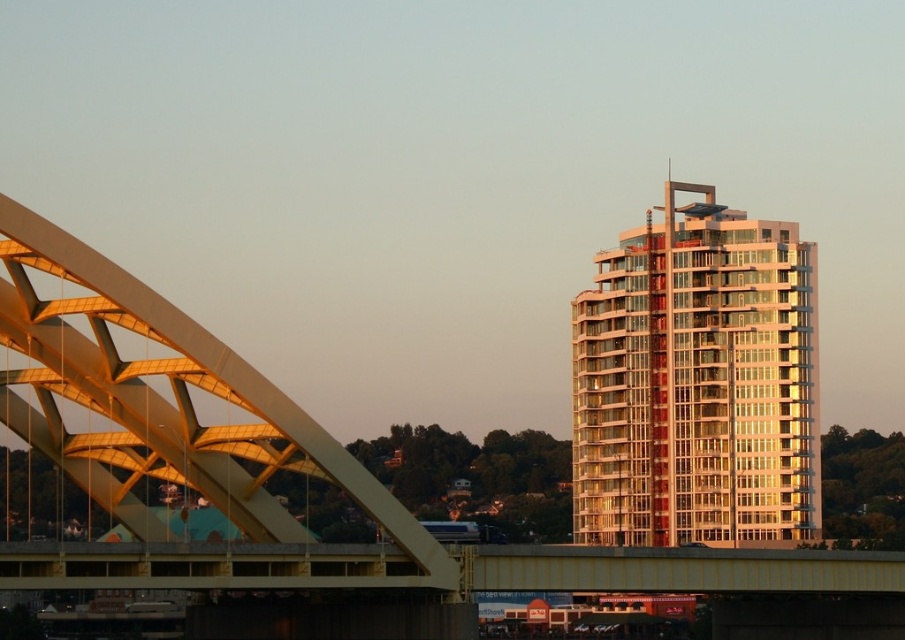
You are a drone operator trying to capture a photo of the golden metallic arch bridge at left and the gold reflective glass building at upper right. However, you notice that one of these objects is blocking the view of the other. Which object is blocking the view of the other?

The gold reflective glass building at upper right is blocking the view of the golden metallic arch bridge at left because the golden metallic arch bridge at left is behind it.

You are a drone operator tasked with capturing aerial footage of the gold reflective glass building at upper right. The drone has a maximum flight range of 200 meters. Based on the scene, can the drone safely reach the building without exceeding its range limit?

The distance between the gold reflective glass building at upper right and the camera is 218.54 meters, which exceeds the drone operator maximum flight range of 200 meters. Therefore, the drone cannot safely reach the building without exceeding its range limit.

You are an urban planner assessing the city layout. You need to determine if the gold reflective glass building at upper right can be seen from the golden metallic arch bridge at left. Based on their sizes and positions, what is your assessment?

The gold reflective glass building at upper right is smaller than the golden metallic arch bridge at left. Since the building is smaller, it might be partially obscured by the bridge or difficult to discern from the bridge, depending on the distance between them. However, without specific distance data, the size difference alone suggests visibility could be challenging.